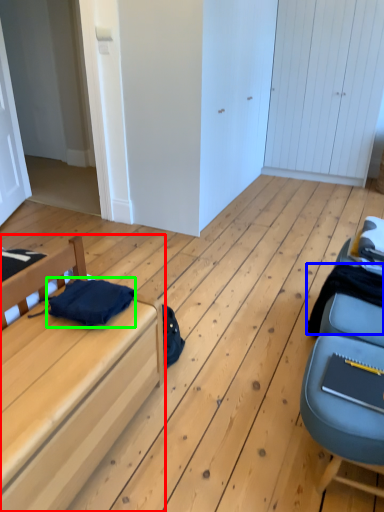
Question: Considering the real-world distances, which object is farthest from furniture (highlighted by a red box)? clothing (highlighted by a blue box) or clothing (highlighted by a green box)?

Choices:
 (A) clothing
 (B) clothing

Answer: (A)